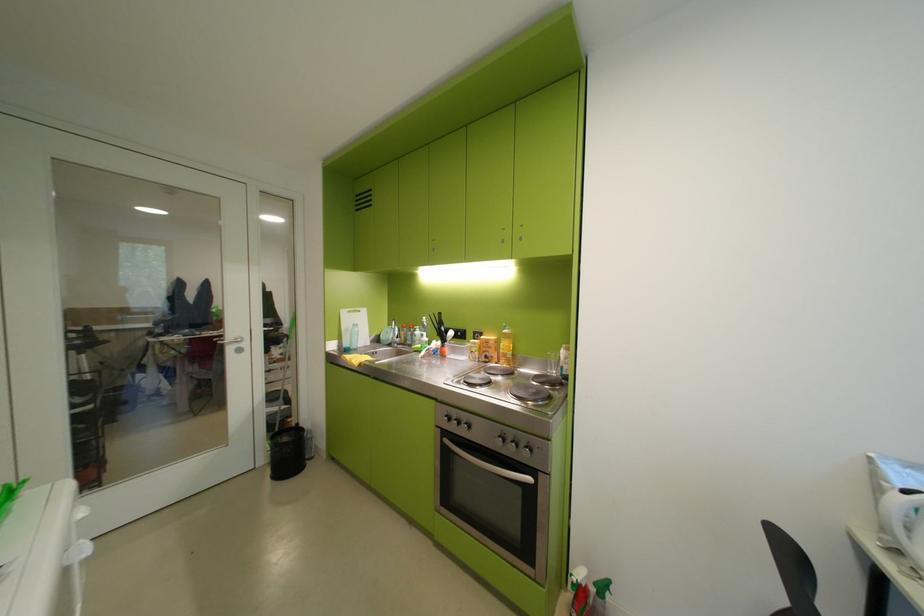
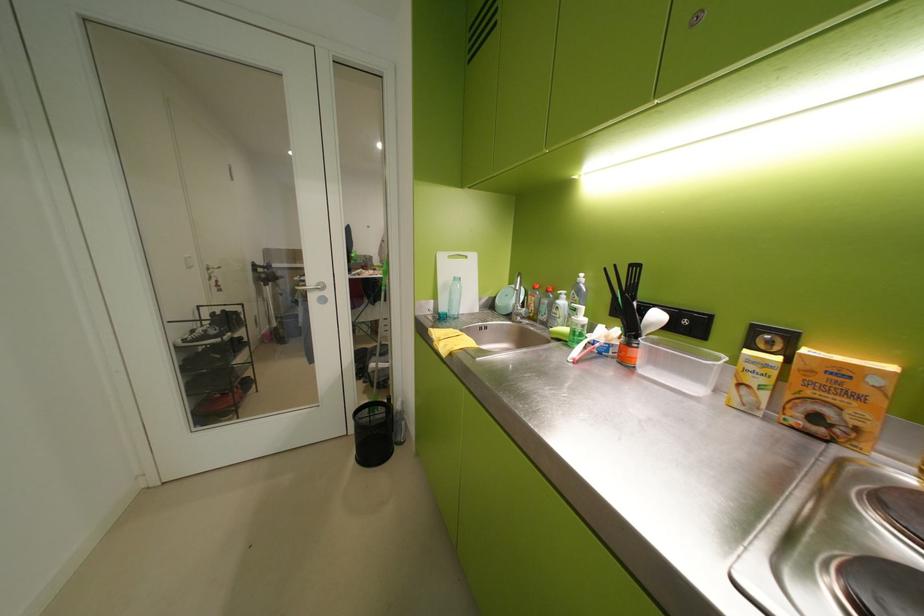
In the second image, find the point that corresponds to (406,342) in the first image.

(529, 315)